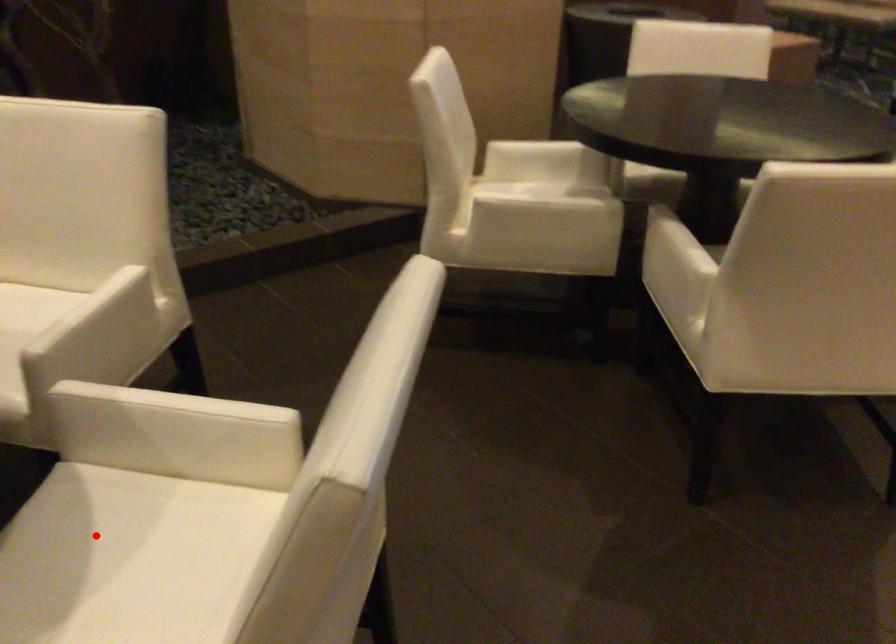
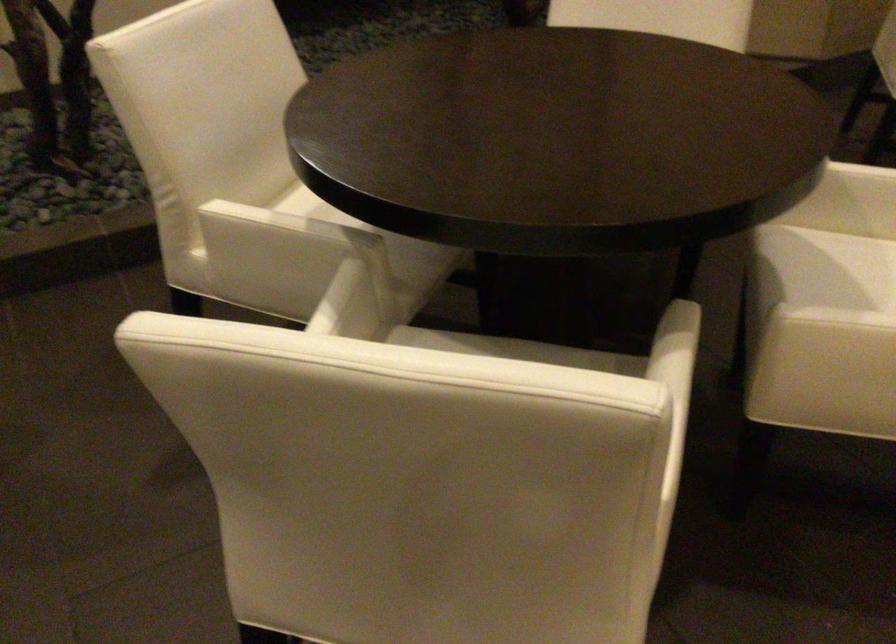
Question: I am providing you with two images of the same scene from different viewpoints. Image1 has a red point marked. In image2, the corresponding 3D location appears at what relative position? Reply with the corresponding letter.

Choices:
 (A) Closer
 (B) Farther

Answer: (B)